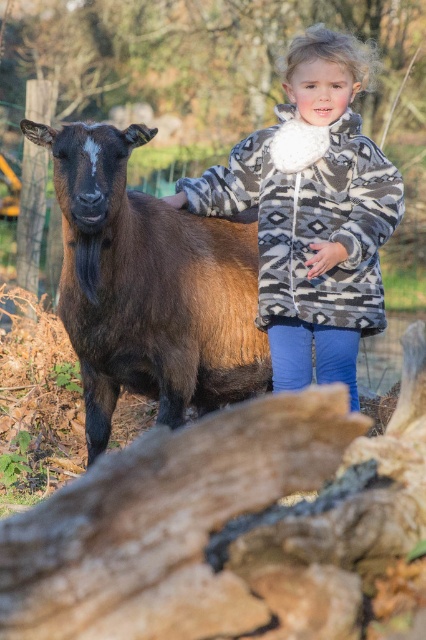
Question: Does brown fuzzy goat at left appear under patterned fleece jacket at center?

Choices:
 (A) yes
 (B) no

Answer: (A)

Question: Is brown fuzzy goat at left to the left of patterned fleece jacket at center from the viewer's perspective?

Choices:
 (A) no
 (B) yes

Answer: (B)

Question: Which point is closer to the camera?

Choices:
 (A) (322, 157)
 (B) (89, 284)

Answer: (B)

Question: Which point is closer to the camera?

Choices:
 (A) (94, 435)
 (B) (400, 192)

Answer: (B)

Question: Which of the following is the closest to the observer?

Choices:
 (A) patterned fleece jacket at center
 (B) brown fuzzy goat at left

Answer: (B)

Question: Is brown fuzzy goat at left bigger than patterned fleece jacket at center?

Choices:
 (A) no
 (B) yes

Answer: (B)